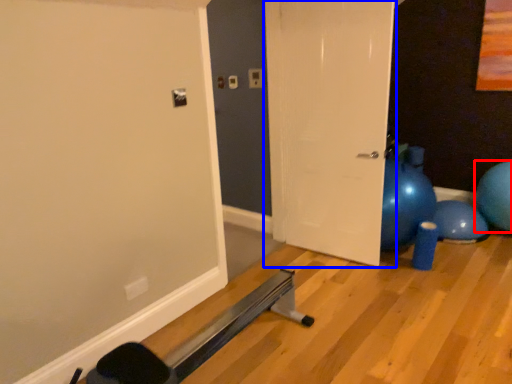
Question: Which of the following is the closest to the observer, ball (highlighted by a red box) or door (highlighted by a blue box)?

Choices:
 (A) ball
 (B) door

Answer: (B)